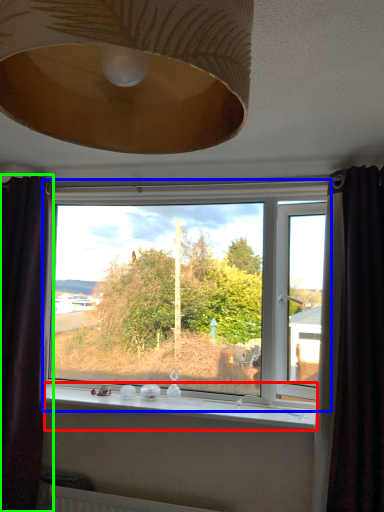
Question: Which object is the farthest from window sill (highlighted by a red box)? Choose among these: window (highlighted by a blue box) or curtain (highlighted by a green box).

Choices:
 (A) window
 (B) curtain

Answer: (B)